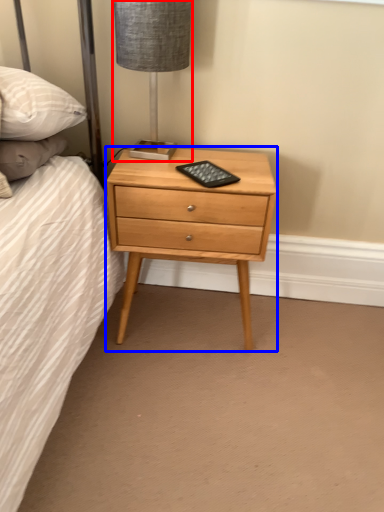
Question: Among these objects, which one is nearest to the camera, table lamp (highlighted by a red box) or nightstand (highlighted by a blue box)?

Choices:
 (A) table lamp
 (B) nightstand

Answer: (A)